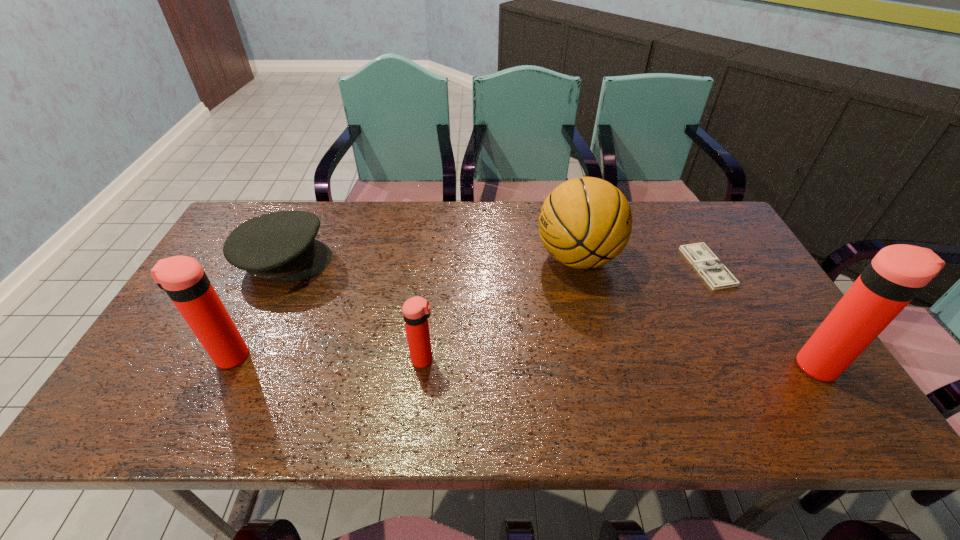
Identify the location of vacant spot for a new thermos_bottle to ensure equal spacing. The width and height of the screenshot is (960, 540). (620, 363).